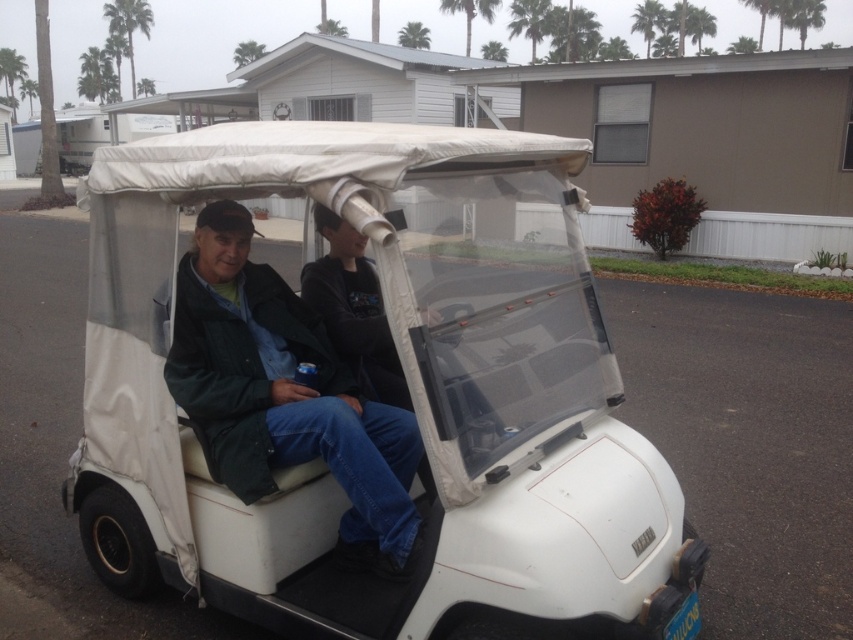
You are standing in the residential neighborhood and want to take a photo of the dark gray fabric jacket at center without the green leafy palm tree at upper left appearing in the background. Is this possible?

The dark gray fabric jacket at center is in front of the green leafy palm tree at upper left, so if you position yourself so that the jacket blocks the view of the palm tree, you can take a photo without the palm tree in the background.

Based on the photo, you are a photographer trying to capture both the dark green jacket at center and the dark gray fabric jacket at center in a single frame. Based on their sizes, which jacket will appear wider in the photo?

The dark green jacket at center will appear wider in the photo because its width is larger than the dark gray fabric jacket at center.

You are a photographer trying to capture both the dark green jacket at center and the dark gray fabric jacket at center in a single shot. Since you want to emphasize the size difference between them, which jacket should you position closer to the camera to achieve this effect?

To emphasize the size difference between the dark green jacket at center and the dark gray fabric jacket at center, position the dark green jacket at center closer to the camera since it is larger in size than the dark gray fabric jacket at center. This will make the larger jacket appear even bigger relative to the smaller one in the photo.